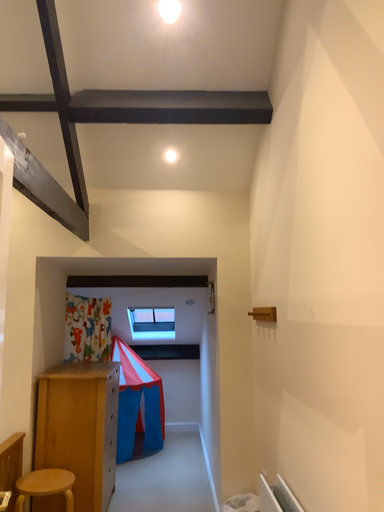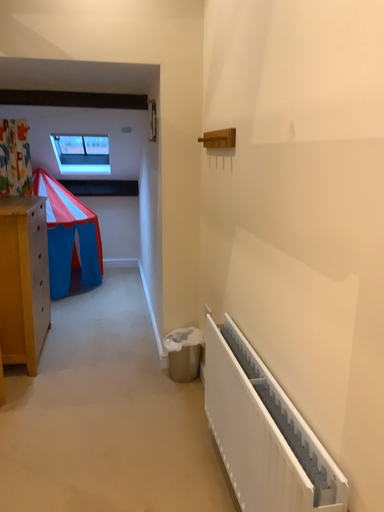
Question: How did the camera likely rotate when shooting the video?

Choices:
 (A) rotated downward
 (B) rotated upward

Answer: (A)